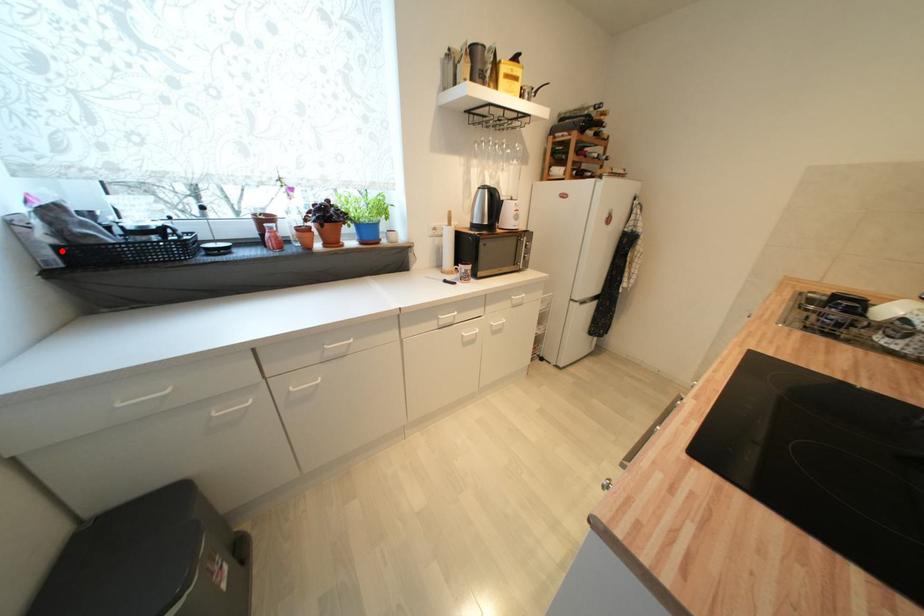
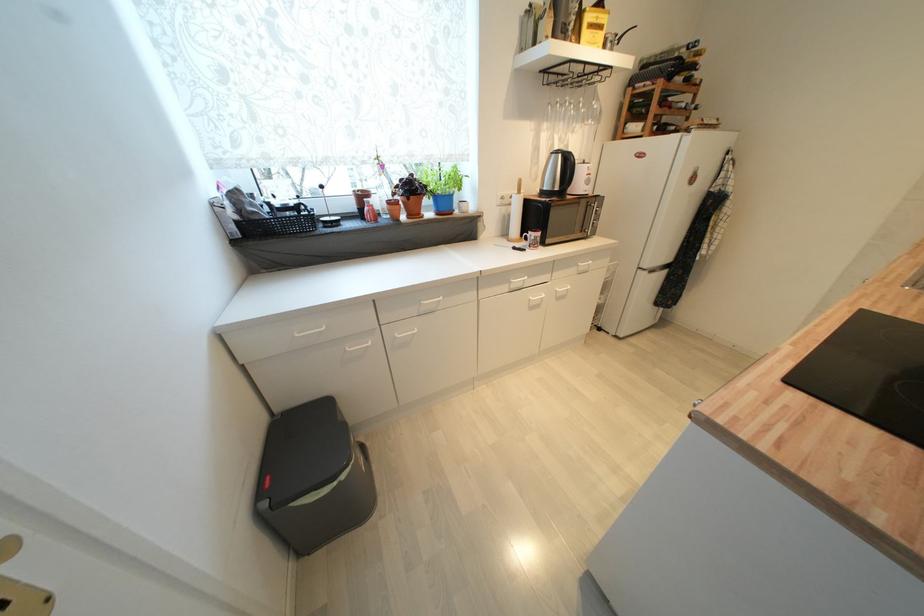
Question: A red point is marked in image1. In image2, is the corresponding 3D point closer to the camera or farther? Reply with the corresponding letter.

Choices:
 (A) The corresponding 3D point is closer.
 (B) The corresponding 3D point is farther.

Answer: (A)